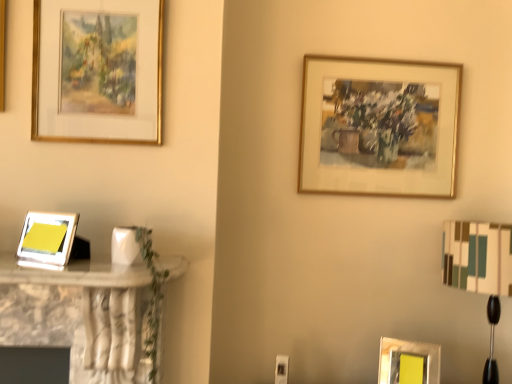
Question: From the image's perspective, relative to matte silver picture frame at lower right, the fourth picture frame when ordered from top to bottom, is gold metallic picture frame at upper right, which is counted as the second picture frame, starting from the top, above or below?

Choices:
 (A) below
 (B) above

Answer: (B)

Question: Considering the positions of point (344, 102) and point (424, 350), is point (344, 102) closer or farther from the camera than point (424, 350)?

Choices:
 (A) farther
 (B) closer

Answer: (A)

Question: Which is farther from the white fabric lampshade at right?

Choices:
 (A) gold-framed painting at upper left, the fourth picture frame in the bottom-to-top sequence
 (B) gold metallic picture frame at upper right, the 3th picture frame viewed from the left
 (C) matte silver picture frame at left, which is the 4th picture frame in right-to-left order
 (D) matte silver picture frame at lower right, the third picture frame positioned from the front

Answer: (C)

Question: Estimate the real-world distances between objects in this image. Which object is farther from the gold metallic picture frame at upper right, placed as the second picture frame when sorted from right to left?

Choices:
 (A) matte silver picture frame at lower right, placed as the 1th picture frame when sorted from right to left
 (B) gold-framed painting at upper left, which appears as the second picture frame when viewed from the front
 (C) matte silver picture frame at left, the 2th picture frame ordered from the bottom
 (D) white fabric lampshade at right

Answer: (C)